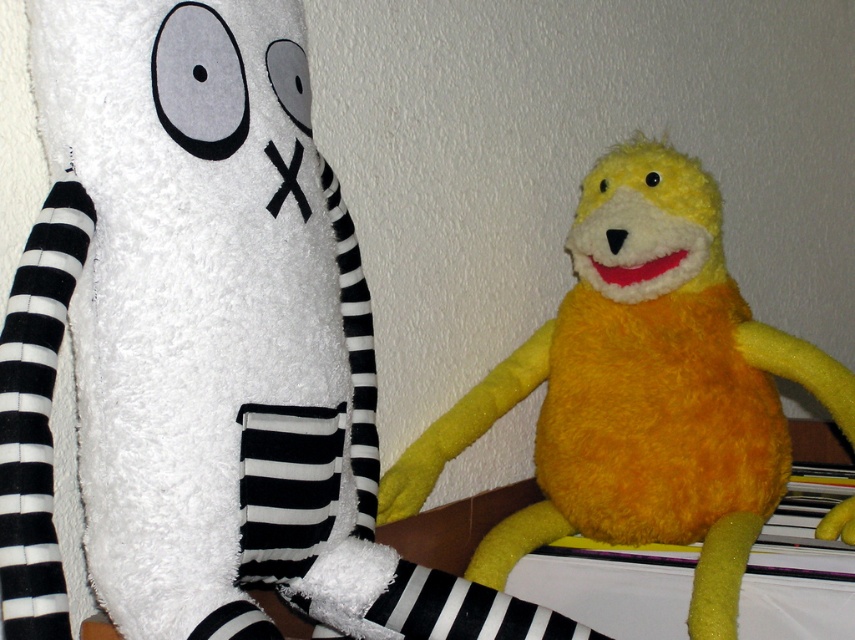
Can you confirm if yellow plush toy at right is wider than yellow fuzzy stuffed animal at center?

No.

Who is more distant from viewer, (50, 556) or (624, 160)?

The point (624, 160) is more distant.

Find the location of a particular element. The width and height of the screenshot is (855, 640). yellow plush toy at right is located at coordinates (203, 348).